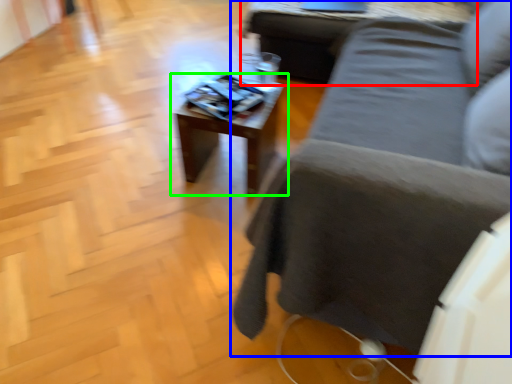
Question: Based on their relative distances, which object is nearer to table (highlighted by a red box)? Choose from studio couch (highlighted by a blue box) and table (highlighted by a green box).

Choices:
 (A) studio couch
 (B) table

Answer: (B)